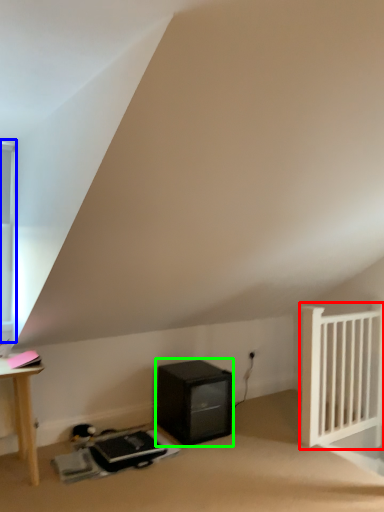
Question: Which object is the farthest from radiator (highlighted by a red box)? Choose among these: window (highlighted by a blue box) or appliance (highlighted by a green box).

Choices:
 (A) window
 (B) appliance

Answer: (A)